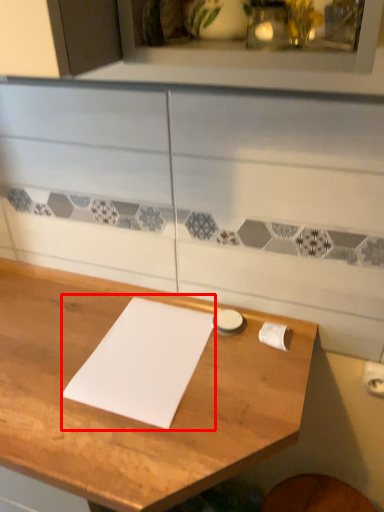
Question: Observing the image, what is the correct spatial positioning of journal (annotated by the red box) in reference to table?

Choices:
 (A) left
 (B) right

Answer: (B)